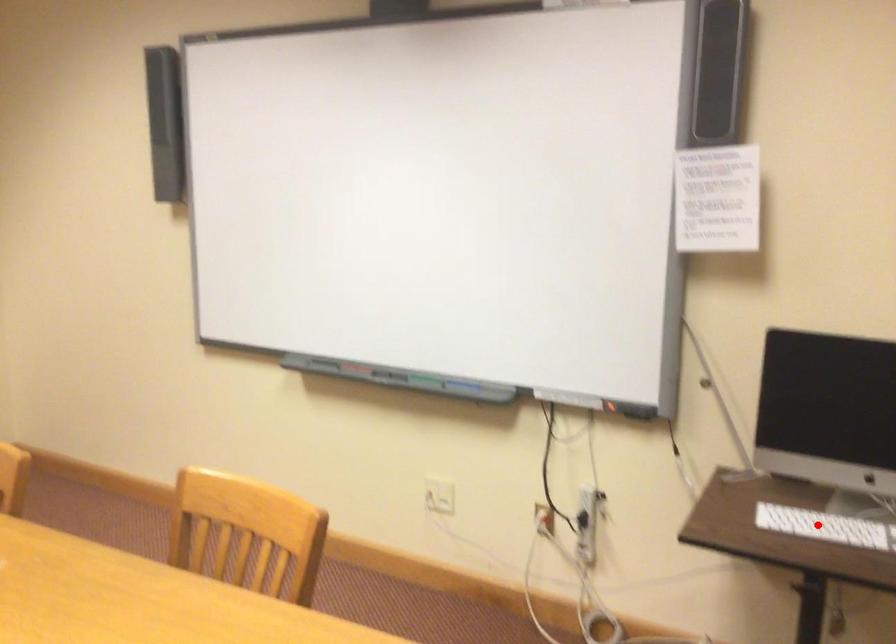
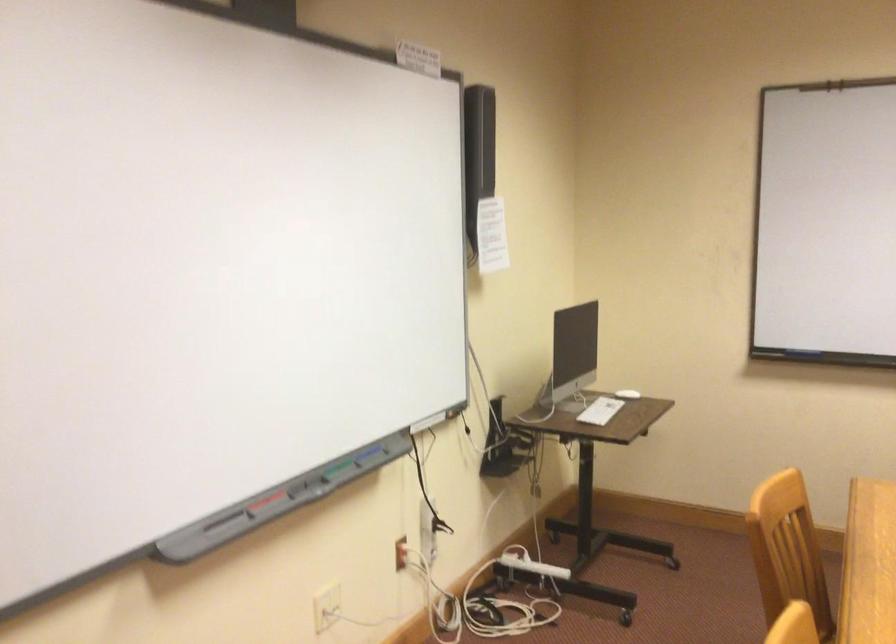
Question: I am providing you with two images of the same scene from different viewpoints. A red point is marked on the first image. At the location where the point appears in image 1, is it still visible in image 2?

Choices:
 (A) Yes
 (B) No

Answer: (A)